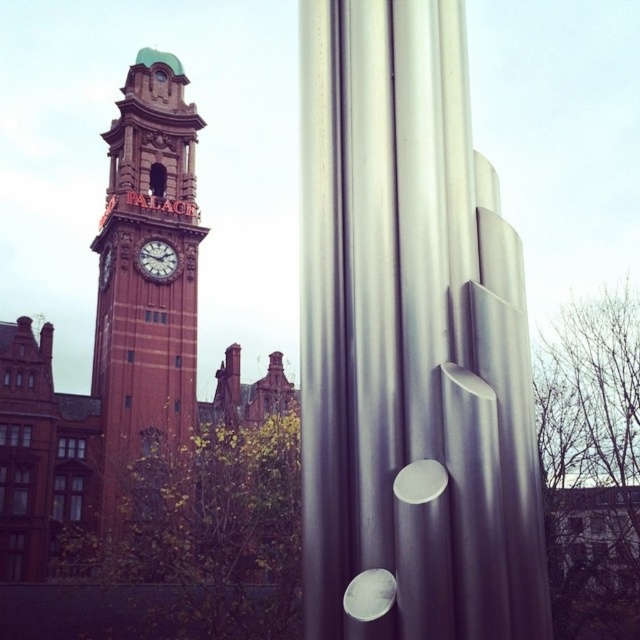
Question: Is red brick clock tower at left thinner than matte red clock at center?

Choices:
 (A) no
 (B) yes

Answer: (A)

Question: Which of the following is the farthest from the observer?

Choices:
 (A) (160, 244)
 (B) (113, 385)

Answer: (A)

Question: Is red brick clock tower at left smaller than matte red clock at center?

Choices:
 (A) yes
 (B) no

Answer: (B)

Question: Can you confirm if red brick clock tower at left is positioned to the right of matte red clock at center?

Choices:
 (A) no
 (B) yes

Answer: (A)